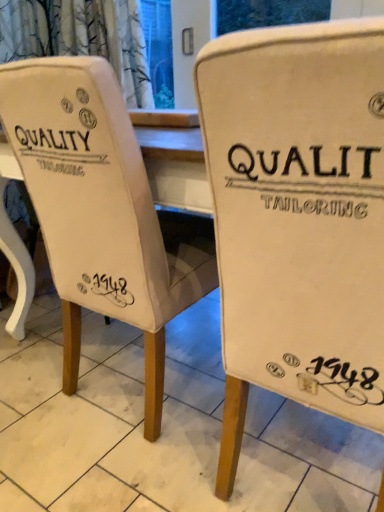
What are the coordinates of `vacant space underneath white fabric chair at center, the second chair viewed from the right (from a real-world perspective)` in the screenshot? It's located at (139, 382).